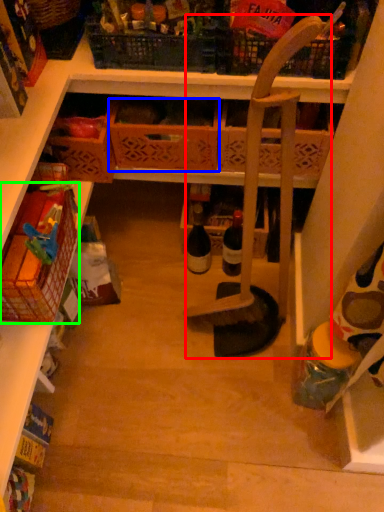
Question: Considering the real-world distances, which object is closest to chair (highlighted by a red box)? basket (highlighted by a blue box) or basket (highlighted by a green box).

Choices:
 (A) basket
 (B) basket

Answer: (A)